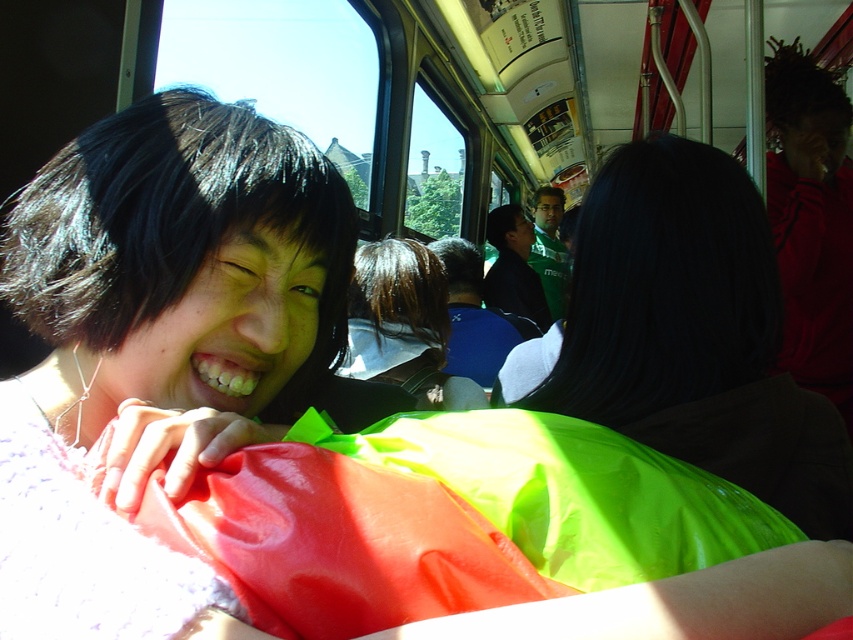
Question: Is neon green fabric at center wider than blue fabric at center?

Choices:
 (A) no
 (B) yes

Answer: (A)

Question: Does neon green fabric at center appear on the left side of blue fabric at center?

Choices:
 (A) no
 (B) yes

Answer: (A)

Question: Can you confirm if blue fabric at center is wider than green jersey at center?

Choices:
 (A) no
 (B) yes

Answer: (B)

Question: Which of the following is the closest to the observer?

Choices:
 (A) (465, 296)
 (B) (383, 280)
 (C) (564, 252)
 (D) (604, 312)

Answer: (D)

Question: Which of the following is the closest to the observer?

Choices:
 (A) (543, 308)
 (B) (392, 336)
 (C) (701, 436)

Answer: (C)

Question: Which of the following is the closest to the observer?

Choices:
 (A) (497, 289)
 (B) (368, 307)
 (C) (612, 410)
 (D) (469, 323)

Answer: (C)